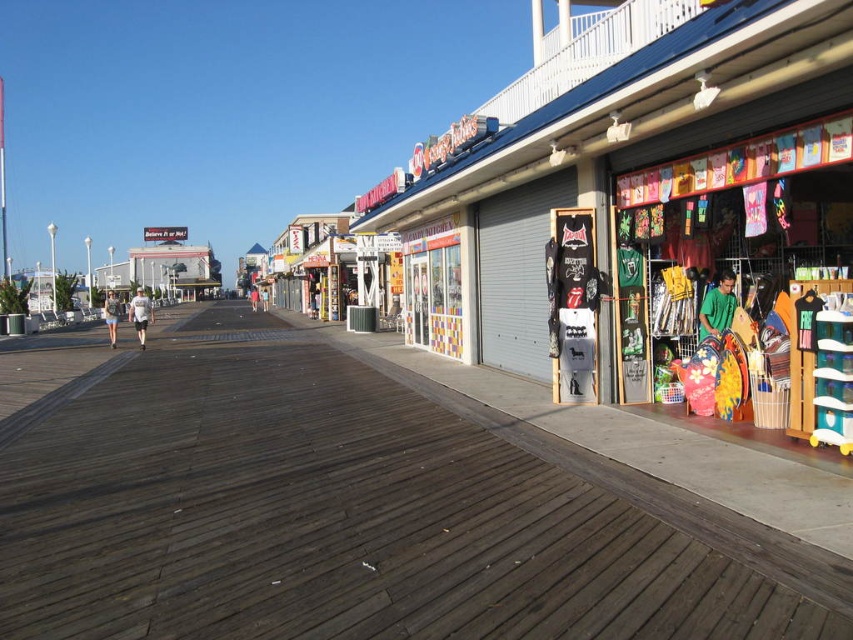
Question: Can you confirm if white cotton shorts at lower left is positioned below light blue t-shirt at center?

Choices:
 (A) yes
 (B) no

Answer: (A)

Question: Is dark brown wood at center positioned before green matte shirt at right?

Choices:
 (A) yes
 (B) no

Answer: (A)

Question: Does green matte shirt at right appear under white cotton shorts at lower left?

Choices:
 (A) yes
 (B) no

Answer: (A)

Question: Which of the following is the farthest from the observer?

Choices:
 (A) white cotton shorts at lower left
 (B) dark brown wood at center
 (C) green matte shirt at right
 (D) light blue t-shirt at center

Answer: (D)

Question: Which object appears farthest from the camera in this image?

Choices:
 (A) white cotton shorts at lower left
 (B) white cotton shirt at center
 (C) green matte shirt at right
 (D) dark brown wood at center

Answer: (A)

Question: Which object appears closest to the camera in this image?

Choices:
 (A) green matte shirt at right
 (B) dark brown wood at center

Answer: (B)